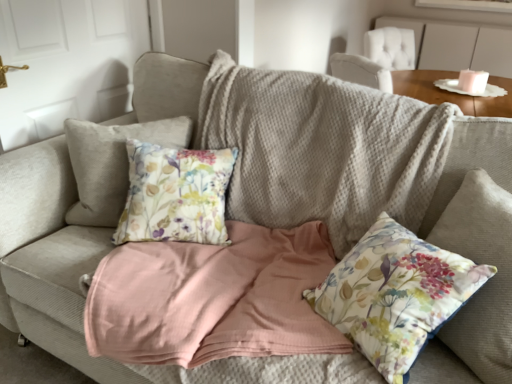
Describe the element at coordinates (451, 92) in the screenshot. I see `wooden table at upper right` at that location.

You are a GUI agent. You are given a task and a screenshot of the screen. Output one action in this format:
    pyautogui.click(x=<x>, y=<y>)
    Task: Click on the wooden table at upper right
    
    Given the screenshot: What is the action you would take?
    pyautogui.click(x=451, y=92)

Measure the distance between wooden table at upper right and camera.

The distance of wooden table at upper right from camera is 1.57 meters.

Consider the image. What is the approximate height of wooden table at upper right?

It is 3.13 inches.

Image resolution: width=512 pixels, height=384 pixels. What do you see at coordinates (395, 294) in the screenshot? I see `floral fabric cushion at center` at bounding box center [395, 294].

The width and height of the screenshot is (512, 384). I want to click on floral fabric cushion at center, so click(395, 294).

Where is `wooden table at upper right`? This screenshot has width=512, height=384. wooden table at upper right is located at coordinates [451, 92].

Considering the positions of objects wooden table at upper right and floral fabric cushion at center in the image provided, who is more to the left, wooden table at upper right or floral fabric cushion at center?

Positioned to the left is floral fabric cushion at center.

Between wooden table at upper right and floral fabric cushion at center, which one is positioned behind?

wooden table at upper right is further from the camera.

Does point (498, 112) lie in front of point (439, 284)?

No, it is behind (439, 284).

From the image's perspective, which is below, wooden table at upper right or floral fabric cushion at center?

floral fabric cushion at center is shown below in the image.

From a real-world perspective, which is physically above, wooden table at upper right or floral fabric cushion at center?

wooden table at upper right.

In terms of width, does wooden table at upper right look wider or thinner when compared to floral fabric cushion at center?

Considering their sizes, wooden table at upper right looks broader than floral fabric cushion at center.

Can you confirm if wooden table at upper right is shorter than floral fabric cushion at center?

Yes, wooden table at upper right is shorter than floral fabric cushion at center.

Can you confirm if wooden table at upper right is bigger than floral fabric cushion at center?

Incorrect, wooden table at upper right is not larger than floral fabric cushion at center.

Looking at this image, is wooden table at upper right surrounding floral fabric cushion at center?

Definitely not — floral fabric cushion at center is not inside wooden table at upper right.

Is wooden table at upper right beside floral fabric cushion at center?

wooden table at upper right is not next to floral fabric cushion at center, and they're not touching.

Looking at this image, could you tell me if wooden table at upper right is facing floral fabric cushion at center?

No, wooden table at upper right is not oriented towards floral fabric cushion at center.

What's the angular difference between wooden table at upper right and floral fabric cushion at center's facing directions?

They differ by 110 degrees in their facing directions.

You are a GUI agent. You are given a task and a screenshot of the screen. Output one action in this format:
    pyautogui.click(x=<x>, y=<y>)
    Task: Click on the pillow in front of the wooden table at upper right
    Image resolution: width=512 pixels, height=384 pixels.
    Given the screenshot: What is the action you would take?
    pyautogui.click(x=395, y=294)

Visually, is floral fabric cushion at center positioned to the left or to the right of wooden table at upper right?

floral fabric cushion at center is positioned on wooden table at upper right's left side.

Is floral fabric cushion at center further to the viewer compared to wooden table at upper right?

No, the depth of floral fabric cushion at center is less than that of wooden table at upper right.

Considering the positions of point (385, 259) and point (439, 98), is point (385, 259) closer or farther from the camera than point (439, 98)?

Point (385, 259).

From the image's perspective, is floral fabric cushion at center located above or below wooden table at upper right?

Clearly, from the image's perspective, floral fabric cushion at center is below wooden table at upper right.

From a real-world perspective, relative to wooden table at upper right, is floral fabric cushion at center vertically above or below?

floral fabric cushion at center is situated lower than wooden table at upper right in the real world.

Can you confirm if floral fabric cushion at center is thinner than wooden table at upper right?

Yes, floral fabric cushion at center is thinner than wooden table at upper right.

Does floral fabric cushion at center have a greater height compared to wooden table at upper right?

Correct, floral fabric cushion at center is much taller as wooden table at upper right.

Can you confirm if floral fabric cushion at center is smaller than wooden table at upper right?

No.

Is wooden table at upper right located within floral fabric cushion at center?

Definitely not — wooden table at upper right is not inside floral fabric cushion at center.

Are floral fabric cushion at center and wooden table at upper right far apart?

floral fabric cushion at center is near wooden table at upper right, not far away.

Is floral fabric cushion at center aimed at wooden table at upper right?

No, floral fabric cushion at center is not aimed at wooden table at upper right.

The width and height of the screenshot is (512, 384). What are the coordinates of `pillow that appears below the wooden table at upper right (from a real-world perspective)` in the screenshot? It's located at (395, 294).

This screenshot has width=512, height=384. Find the location of `table that is on the right side of floral fabric cushion at center`. table that is on the right side of floral fabric cushion at center is located at coordinates (451, 92).

The height and width of the screenshot is (384, 512). Identify the location of pillow below the wooden table at upper right (from the image's perspective). (395, 294).